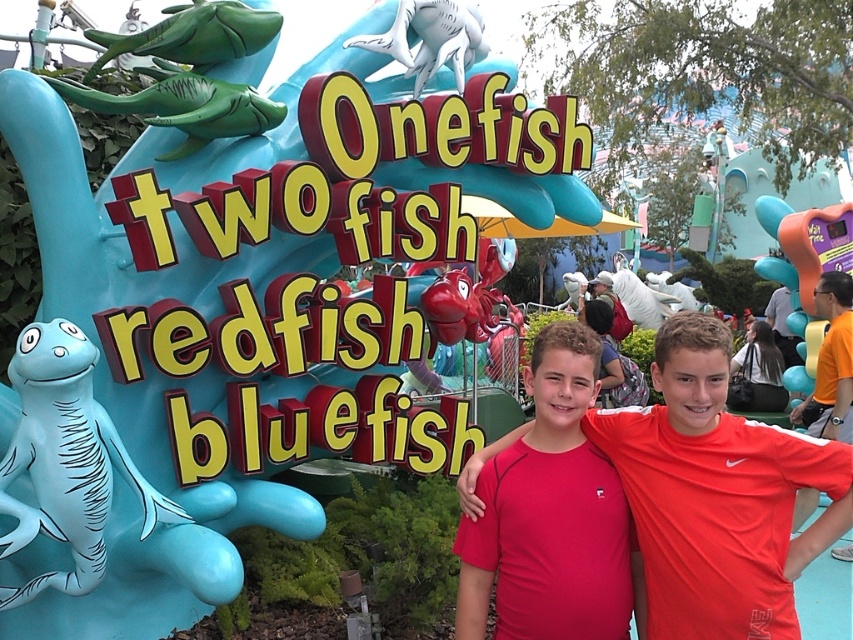
You are a photographer trying to capture the whimsical sign in the background while focusing on the two boys in red shirts. Given their positions, can you confirm if the red matte shirt at center is positioned in the central area of the image to ensure both the sign and the boys are in frame?

The red matte shirt at center is located at point (717, 493), which is slightly off the exact center. To ensure both the sign and the boys are in frame, adjust the camera to center the boys while keeping the sign visible in the background.

You are a photographer at the theme park and need to ensure both the red matte shirt at center and the pink fabric shirt at center are clearly visible in your photo. Since the shirts are at the same position, which one might be more visible due to its size?

The red matte shirt at center is larger in size than the pink fabric shirt at center, so it will be more visible in the photo.

You are a photographer trying to capture the two boys in front of the whimsical sign. Since you want to focus on their clothing, which shirt should you adjust your camera to the right to capture better, the red matte shirt at center or the pink fabric shirt at center?

The red matte shirt at center is positioned on the right side of the pink fabric shirt at center, so adjusting the camera to the right would better capture the red matte shirt at center.